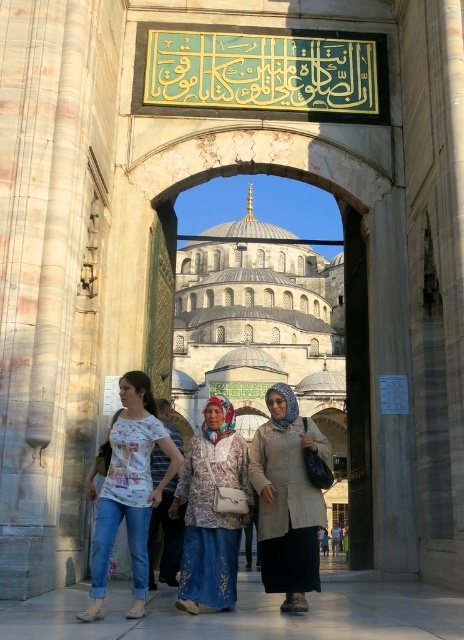
Question: Can you confirm if white printed t-shirt at center is positioned below floral printed shirt at center?

Choices:
 (A) yes
 (B) no

Answer: (A)

Question: Which object is the farthest from the printed cotton dress at center?

Choices:
 (A) white printed t-shirt at center
 (B) beige woolen cardigan at center
 (C) denim skirt at center

Answer: (C)

Question: From the image, what is the correct spatial relationship of beige woolen cardigan at center in relation to floral printed shirt at center?

Choices:
 (A) left
 (B) right

Answer: (B)

Question: Which of the following is the farthest from the observer?

Choices:
 (A) beige woolen cardigan at center
 (B) floral printed shirt at center
 (C) blue stone archway at center

Answer: (C)

Question: Among these objects, which one is nearest to the camera?

Choices:
 (A) beige woolen cardigan at center
 (B) denim skirt at center
 (C) blue stone archway at center
 (D) printed cotton dress at center

Answer: (D)

Question: Observing the image, what is the correct spatial positioning of printed cotton dress at center in reference to denim skirt at center?

Choices:
 (A) right
 (B) left

Answer: (B)